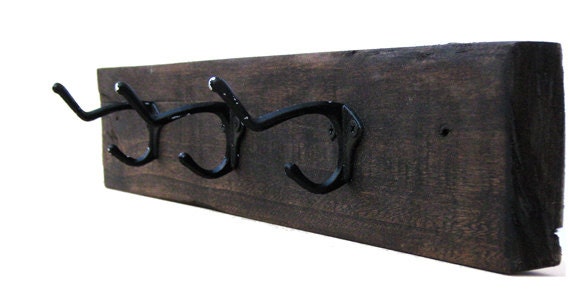
Locate an element on the screen. The image size is (570, 300). visible screws is located at coordinates (354, 129), (335, 133), (236, 125), (225, 125).